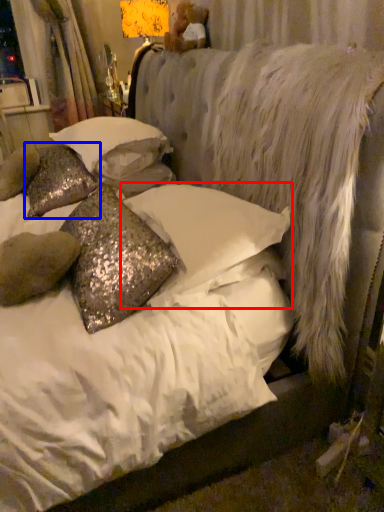
Question: Among these objects, which one is nearest to the camera, pillow (highlighted by a red box) or pillow (highlighted by a blue box)?

Choices:
 (A) pillow
 (B) pillow

Answer: (A)